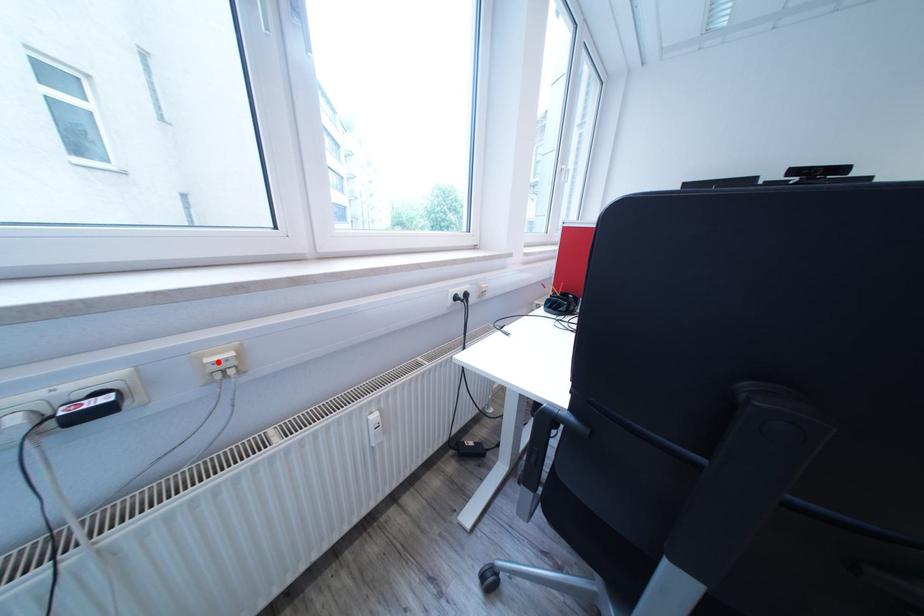
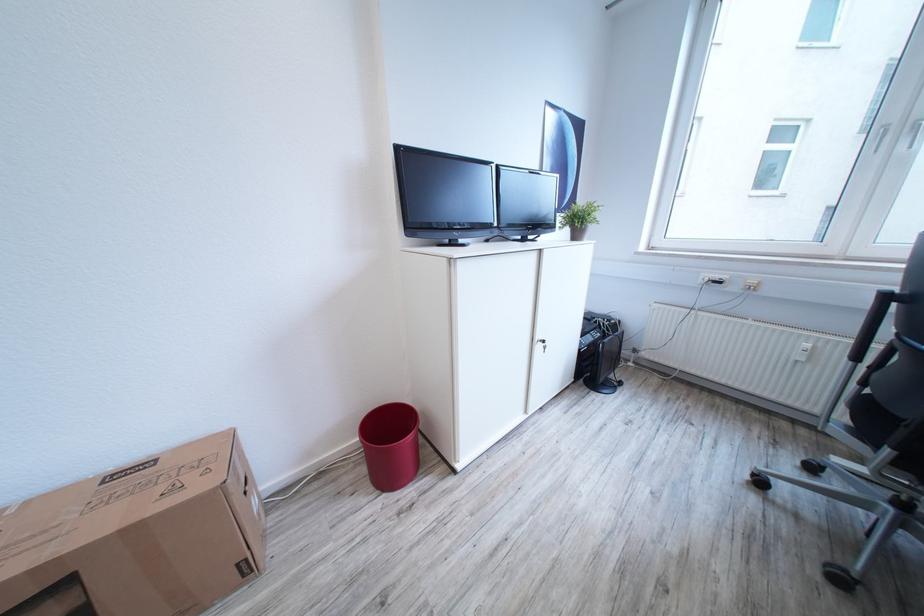
Locate, in the second image, the point that corresponds to the highlighted location in the first image.

(759, 284)